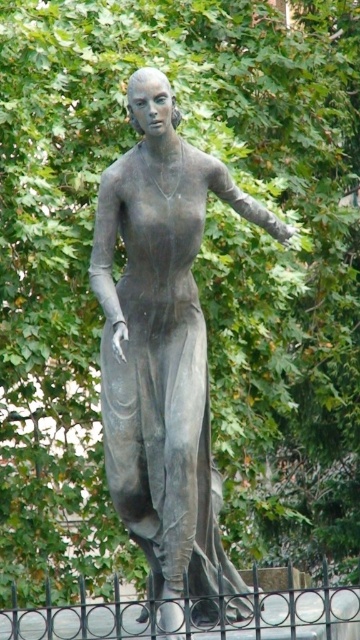
Can you confirm if bronze statue at center is taller than black wrought iron fence at lower center?

Correct, bronze statue at center is much taller as black wrought iron fence at lower center.

Looking at this image, who is higher up, bronze statue at center or black wrought iron fence at lower center?

Positioned higher is bronze statue at center.

Between point (158, 314) and point (312, 593), which one is positioned in front?

Point (158, 314)

Identify the location of bronze statue at center. (162, 340).